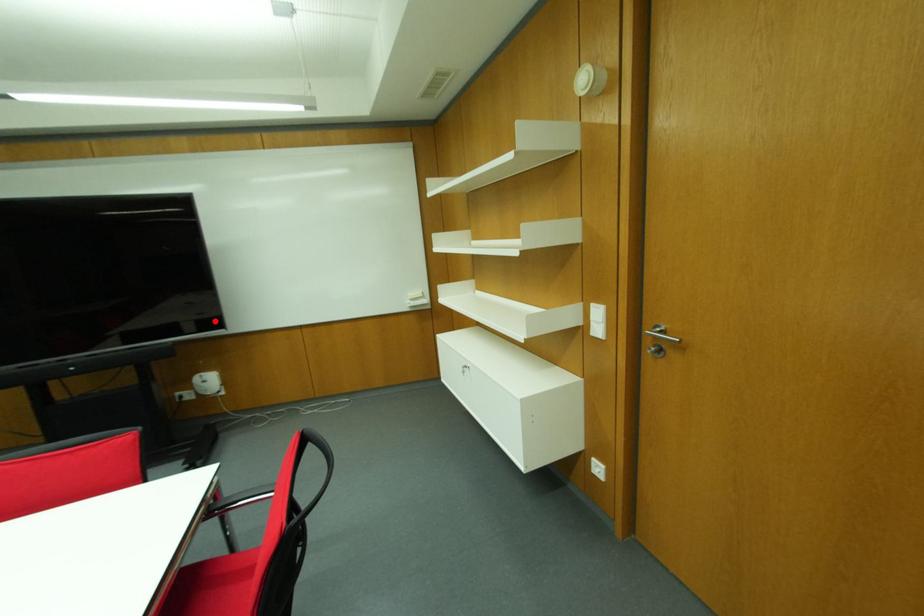
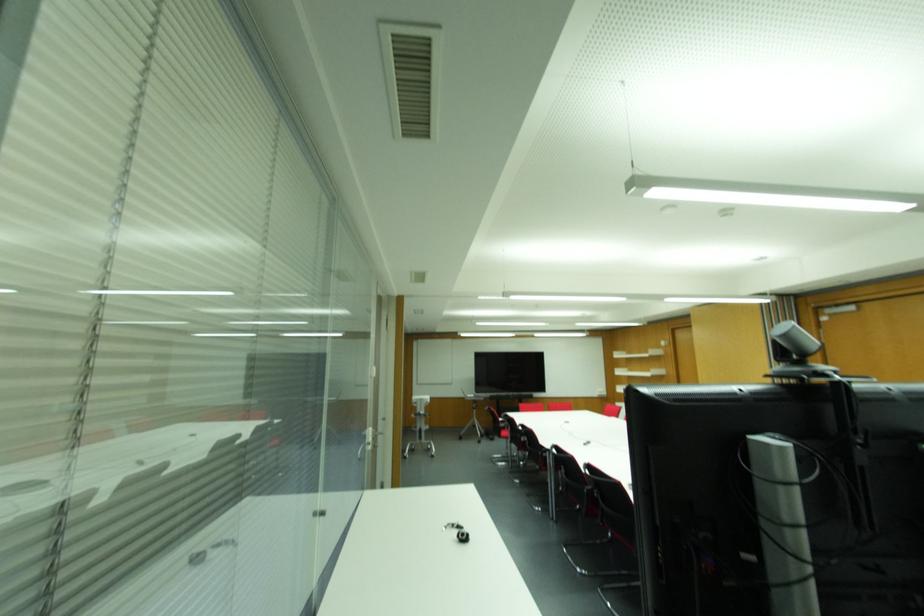
The point at the highlighted location is marked in the first image. Where is the corresponding point in the second image?

(541, 389)